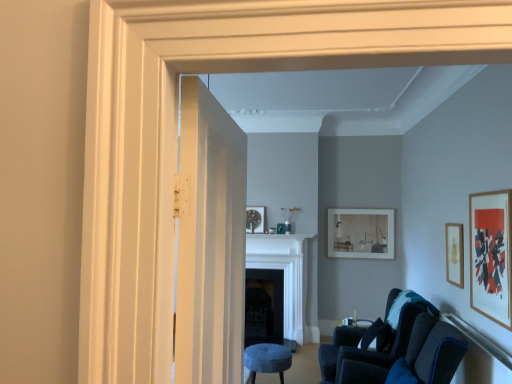
Question: From a real-world perspective, is velvet dark blue chair at lower right physically located above or below velvet blue stool at lower center?

Choices:
 (A) below
 (B) above

Answer: (B)

Question: Considering their positions, is velvet dark blue chair at lower right located in front of or behind velvet blue stool at lower center?

Choices:
 (A) behind
 (B) front

Answer: (B)

Question: Considering the real-world distances, which object is farthest from the velvet blue stool at lower center?

Choices:
 (A) white wooden door at center
 (B) black matte fireplace at center, placed as the second fireplace when sorted from front to back
 (C) matte white picture frame at center-right, marked as the first picture frame in a back-to-front arrangement
 (D) wooden picture frame at right, which is the second picture frame from back to front
 (E) white marble fireplace at center, positioned as the 1th fireplace in front-to-back order

Answer: (A)

Question: Based on their relative distances, which object is nearer to the wooden picture frame at right, the 2th picture frame when ordered from front to back?

Choices:
 (A) velvet dark blue chair at lower right
 (B) matte white picture frame at center-right, which appears as the 3th picture frame when viewed from the front
 (C) white wooden door at center
 (D) white marble fireplace at center, which is the second fireplace from back to front
 (E) velvet blue stool at lower center

Answer: (A)